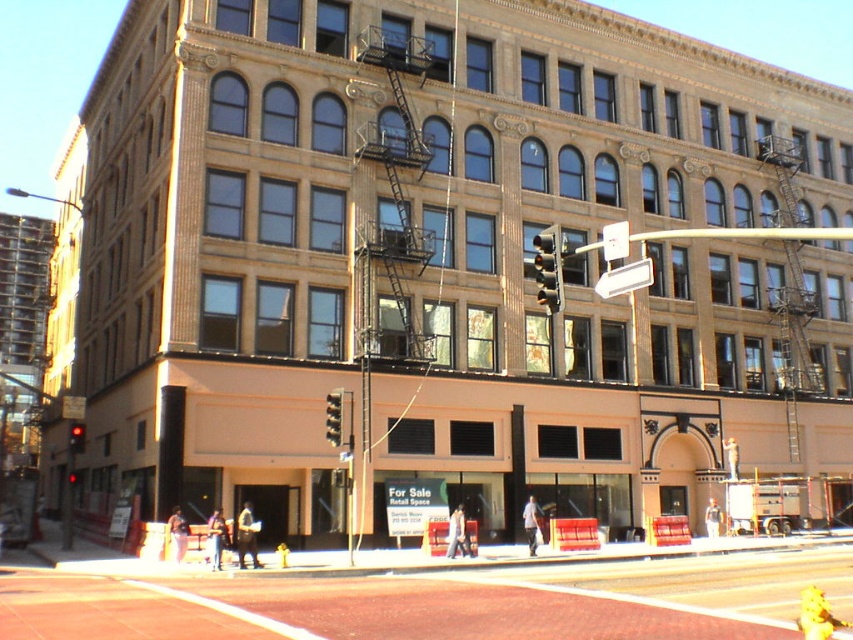
Question: Which of these objects is positioned farthest from the metallic glass traffic light at center?

Choices:
 (A) metallic traffic light at center
 (B) yellow matte fire hydrant at lower right
 (C) white plastic street sign at upper center

Answer: (B)

Question: Does red glass traffic light at center have a larger size compared to yellow matte fire hydrant at lower right?

Choices:
 (A) no
 (B) yes

Answer: (B)

Question: Which point appears closest to the camera in this image?

Choices:
 (A) (325, 438)
 (B) (538, 257)

Answer: (B)

Question: In this image, where is white plastic street sign at upper center located relative to yellow matte fire hydrant at lower right?

Choices:
 (A) right
 (B) left

Answer: (A)

Question: Which point is closer to the camera taking this photo?

Choices:
 (A) (543, 301)
 (B) (82, 444)
 (C) (643, 273)

Answer: (C)

Question: Does white plastic street sign at upper center have a greater width compared to metallic traffic light at center?

Choices:
 (A) yes
 (B) no

Answer: (A)